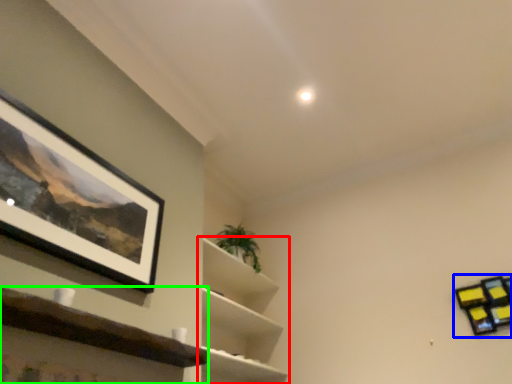
Question: Estimate the real-world distances between objects in this image. Which object is farther from shelf (highlighted by a red box), shelf (highlighted by a blue box) or shelf (highlighted by a green box)?

Choices:
 (A) shelf
 (B) shelf

Answer: (A)